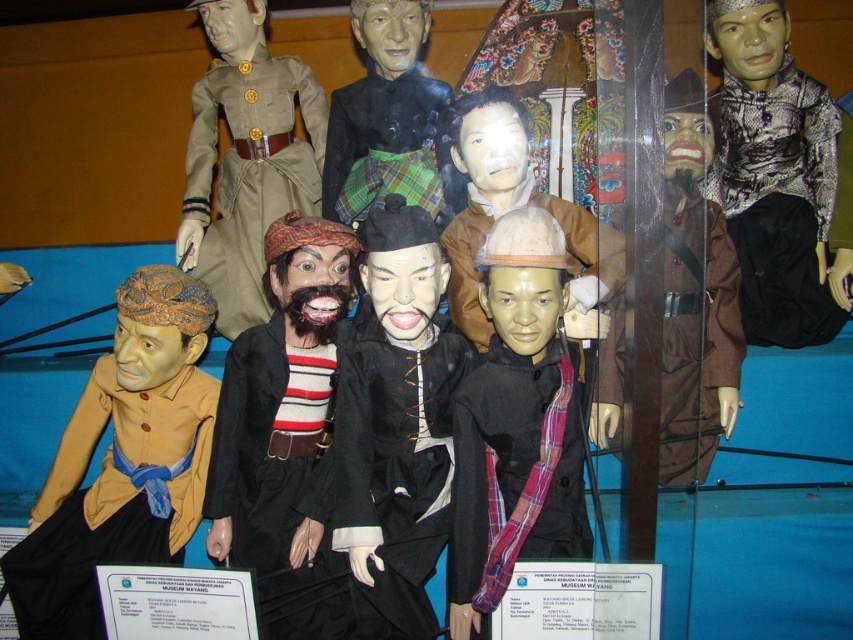
You are a museum curator planning to install a spotlight on the point at coordinates point (247, 157). According to the scene description, what object will the spotlight illuminate?

The spotlight at point (247, 157) will illuminate the matte brown uniform at upper left.

You are a museum curator arranging an exhibition. You have two items to place next to each other on a narrow shelf that can only accommodate items up to 30 cm in width. The brown matte jacket at lower left and the striped wool sweater at center are both candidates. According to the description, which item is wider and would you recommend placing first to ensure they both fit?

The brown matte jacket at lower left might be wider than striped wool sweater at center. To ensure both items fit on the shelf, it is advisable to place the narrower striped wool sweater at center first, followed by the potentially wider brown matte jacket at lower left, provided their combined width does not exceed 30 cm.

You are a museum visitor standing in front of the Wayang Kulit puppet display. You notice two points in the scene, one at coordinates point (186, 406) and the other at point (303, 577). Which point is closer to you?

Point (186, 406) is further to the camera than point (303, 577), so the point closer to you is point (303, 577).